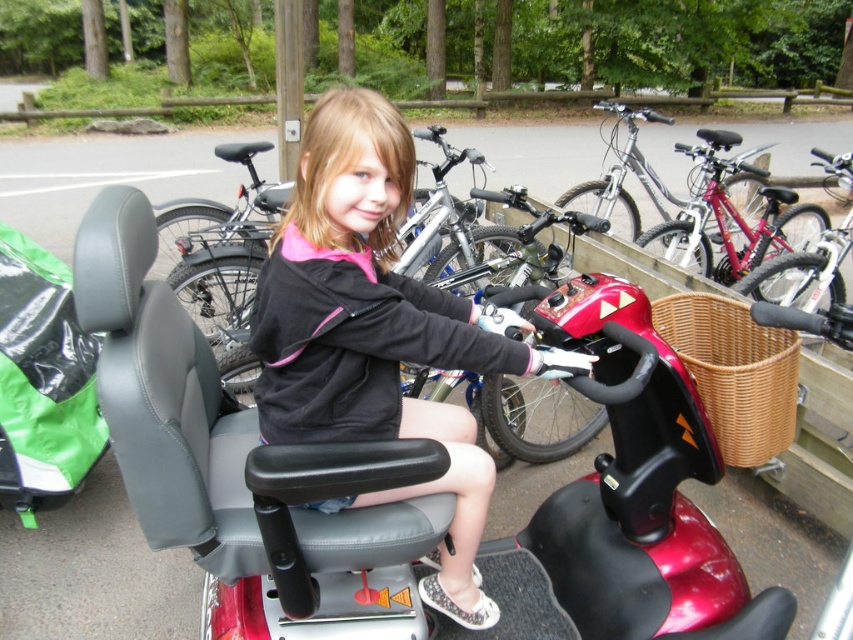
Question: Is black leather jacket at center positioned before shiny red bicycle at center?

Choices:
 (A) yes
 (B) no

Answer: (A)

Question: Does shiny red scooter at center appear under shiny red bicycle at center?

Choices:
 (A) yes
 (B) no

Answer: (A)

Question: Estimate the real-world distances between objects in this image. Which object is closer to the shiny red scooter at center?

Choices:
 (A) black leather jacket at center
 (B) shiny red bicycle at center

Answer: (A)

Question: Does shiny red scooter at center appear on the right side of shiny red bicycle at center?

Choices:
 (A) yes
 (B) no

Answer: (B)

Question: Which object is the closest to the shiny red bicycle at center?

Choices:
 (A) black leather jacket at center
 (B) shiny red scooter at center

Answer: (B)

Question: Which point is farther to the camera?

Choices:
 (A) (x=426, y=364)
 (B) (x=721, y=208)
 (C) (x=622, y=570)

Answer: (B)